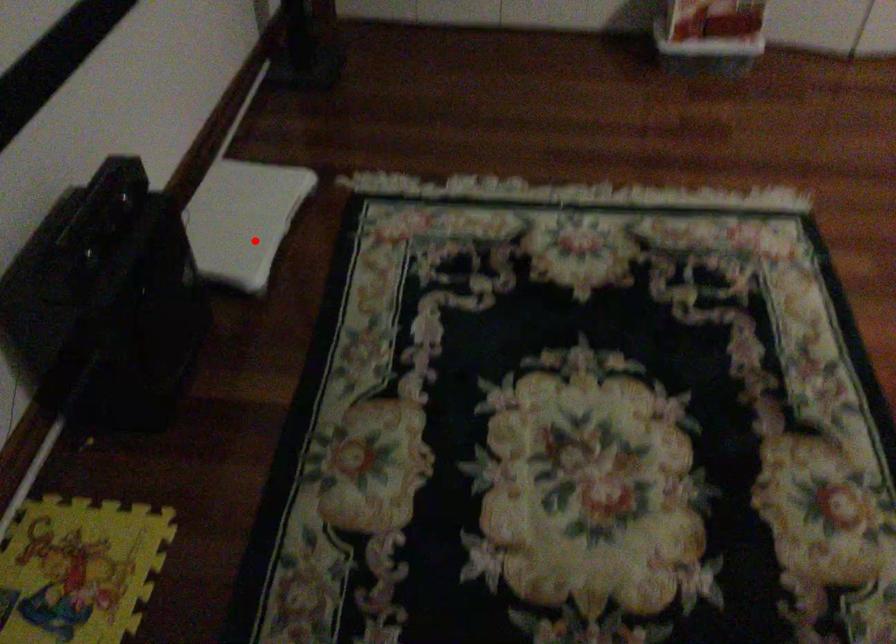
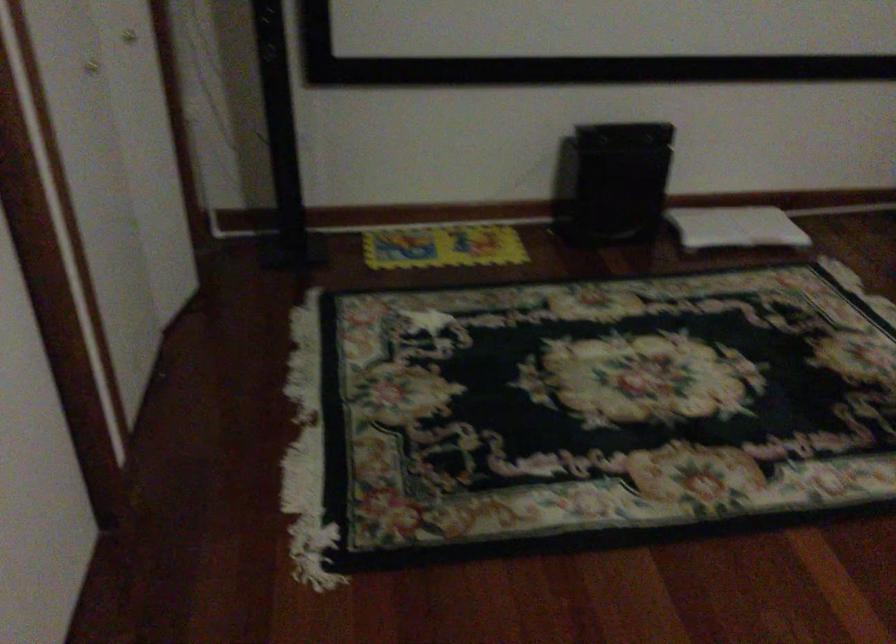
In the second image, find the point that corresponds to the highlighted location in the first image.

(735, 227)